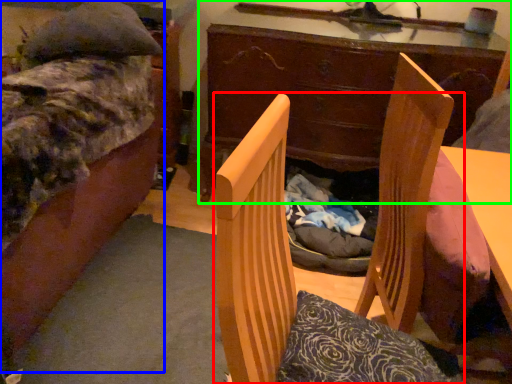
Question: Which object is the farthest from chair (highlighted by a red box)? Choose among these: bed (highlighted by a blue box) or desk (highlighted by a green box).

Choices:
 (A) bed
 (B) desk

Answer: (B)